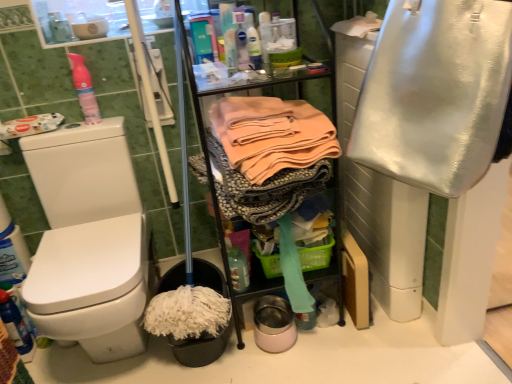
Where is `free space in front of pink matte spray can at upper left`? The image size is (512, 384). free space in front of pink matte spray can at upper left is located at coordinates (83, 129).